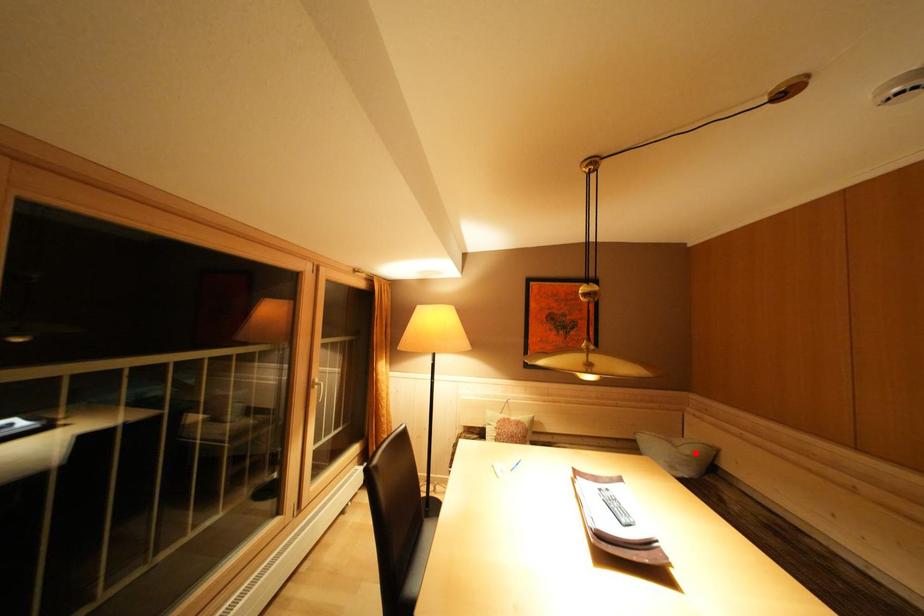
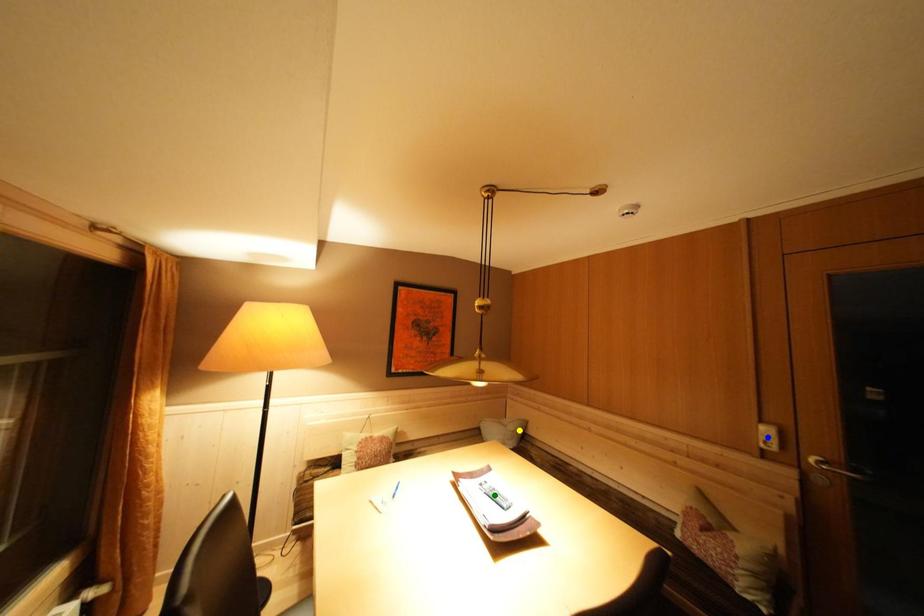
Question: I am providing you with two images of the same scene from different viewpoints. A red point is marked on the first image. You are given multiple points on the second image. Which spot in image 2 lines up with the point in image 1?

Choices:
 (A) blue point
 (B) green point
 (C) yellow point

Answer: (C)